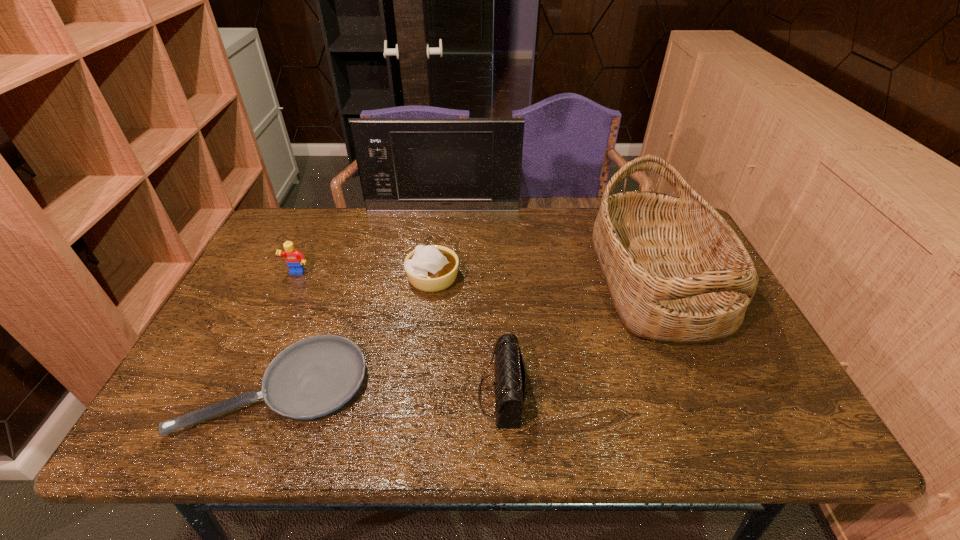
Locate an element on the screen. The height and width of the screenshot is (540, 960). vacant area that lies between the whipped cream and the frying pan is located at coordinates (356, 333).

Where is `free spot between the rightmost object and the Lego`? The width and height of the screenshot is (960, 540). free spot between the rightmost object and the Lego is located at coordinates (476, 278).

Where is `unoccupied position between the Lego and the whipped cream`? The height and width of the screenshot is (540, 960). unoccupied position between the Lego and the whipped cream is located at coordinates (365, 276).

You are a GUI agent. You are given a task and a screenshot of the screen. Output one action in this format:
    pyautogui.click(x=<x>, y=<y>)
    Task: Click on the vacant space that's between the farthest object and the clutch bag
    
    Given the screenshot: What is the action you would take?
    pyautogui.click(x=472, y=302)

At what (x,y) coordinates should I click in order to perform the action: click on free space that is in between the Lego and the frying pan. Please return your answer as a coordinate pair (x, y). Looking at the image, I should click on (288, 331).

Identify the location of vacant space in between the clutch bag and the shortest object. coord(390,391).

Where is `free spot between the shortest object and the Lego`? free spot between the shortest object and the Lego is located at coordinates (288, 331).

Locate an element on the screen. The image size is (960, 540). free spot between the tallest object and the clutch bag is located at coordinates (472, 302).

Where is `free space between the clutch bag and the Lego`? free space between the clutch bag and the Lego is located at coordinates (399, 334).

I want to click on object that is the closest one to the shortest object, so 432,268.